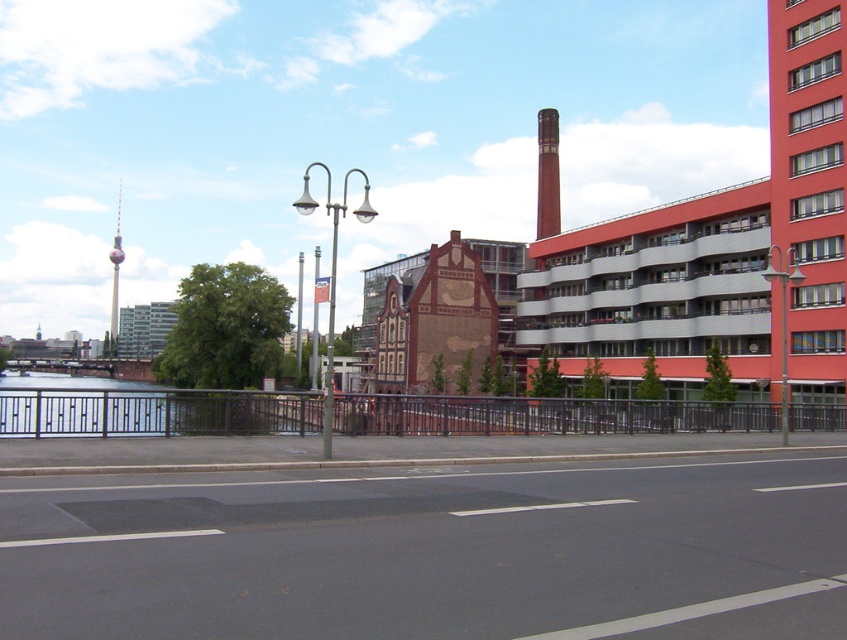
Question: Is metallic water at left to the left of red brick chimney at center from the viewer's perspective?

Choices:
 (A) no
 (B) yes

Answer: (B)

Question: Which object appears closest to the camera in this image?

Choices:
 (A) metallic water at left
 (B) red brick chimney at center

Answer: (A)

Question: Which point is closer to the camera?

Choices:
 (A) (558, 218)
 (B) (21, 394)

Answer: (B)

Question: Is metallic water at left to the left of red brick chimney at center from the viewer's perspective?

Choices:
 (A) yes
 (B) no

Answer: (A)

Question: Among these points, which one is nearest to the camera?

Choices:
 (A) (543, 189)
 (B) (151, 404)

Answer: (B)

Question: In this image, where is metallic water at left located relative to red brick chimney at center?

Choices:
 (A) below
 (B) above

Answer: (A)